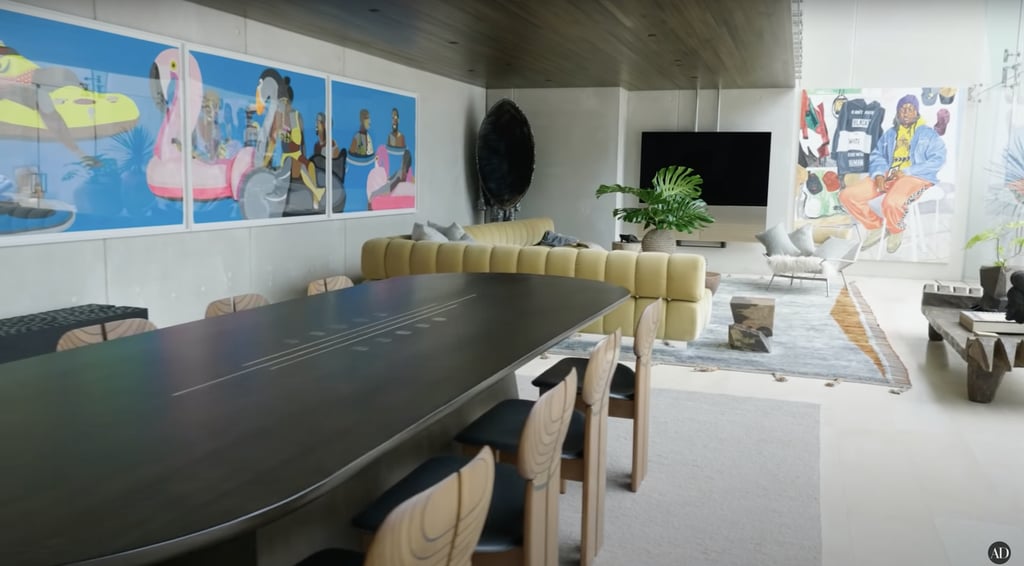
This screenshot has height=566, width=1024. Find the location of `single arm chair`. single arm chair is located at coordinates (810, 256).